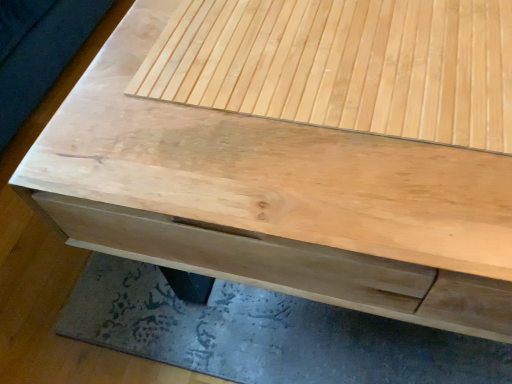
At what (x,y) coordinates should I click in order to perform the action: click on vacant area that is in front of natural wood plywood at upper center. Please return your answer as a coordinate pair (x, y). The height and width of the screenshot is (384, 512). Looking at the image, I should click on (346, 190).